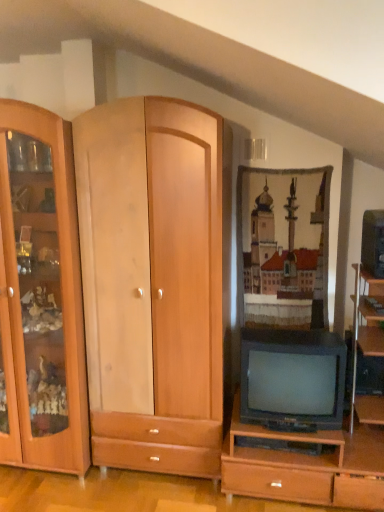
Question: Does matte black television at right, acting as the first television starting from the right, contain matte black television at center, placed as the first television when sorted from left to right?

Choices:
 (A) no
 (B) yes

Answer: (A)

Question: From the image's perspective, is matte black television at right, placed as the second television when sorted from bottom to top, below matte black television at center, the second television when ordered from right to left?

Choices:
 (A) yes
 (B) no

Answer: (B)

Question: Can we say matte black television at right, placed as the second television when sorted from bottom to top, lies outside matte black television at center, the 2th television positioned from the top?

Choices:
 (A) yes
 (B) no

Answer: (A)

Question: Is matte black television at right, acting as the second television starting from the left, shorter than matte black television at center, acting as the 1th television starting from the bottom?

Choices:
 (A) no
 (B) yes

Answer: (B)

Question: Considering the relative sizes of matte black television at right, acting as the first television starting from the right, and matte black television at center, the 2th television positioned from the top, in the image provided, is matte black television at right, acting as the first television starting from the right, wider than matte black television at center, the 2th television positioned from the top,?

Choices:
 (A) no
 (B) yes

Answer: (A)

Question: Does matte black television at right, acting as the first television starting from the right, have a larger size compared to matte black television at center, placed as the first television when sorted from left to right?

Choices:
 (A) yes
 (B) no

Answer: (B)

Question: Can you confirm if matte black television at center, the 2th television positioned from the top, is positioned to the left of matte black television at right, acting as the second television starting from the left?

Choices:
 (A) yes
 (B) no

Answer: (A)

Question: Is matte black television at center, acting as the 1th television starting from the bottom, positioned behind matte black television at right, placed as the second television when sorted from bottom to top?

Choices:
 (A) yes
 (B) no

Answer: (A)

Question: Can you confirm if matte black television at center, the second television when ordered from right to left, is smaller than matte black television at right, placed as the second television when sorted from bottom to top?

Choices:
 (A) yes
 (B) no

Answer: (B)

Question: Can you confirm if matte black television at center, acting as the 1th television starting from the bottom, is bigger than matte black television at right, acting as the second television starting from the left?

Choices:
 (A) no
 (B) yes

Answer: (B)

Question: Does matte black television at center, the 2th television positioned from the top, have a lesser height compared to matte black television at right, acting as the second television starting from the left?

Choices:
 (A) yes
 (B) no

Answer: (B)

Question: Can you confirm if matte black television at center, placed as the first television when sorted from left to right, is taller than matte black television at right, placed as the second television when sorted from bottom to top?

Choices:
 (A) no
 (B) yes

Answer: (B)

Question: From a real-world perspective, relative to matte black television at right, acting as the first television starting from the right, is matte black television at center, acting as the 1th television starting from the bottom, vertically above or below?

Choices:
 (A) above
 (B) below

Answer: (B)